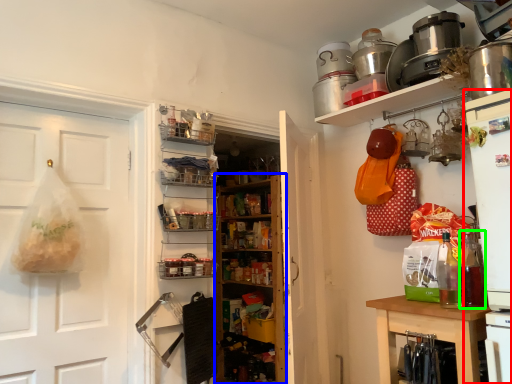
Question: Estimate the real-world distances between objects in this image. Which object is closer to appliance (highlighted by a red box), bookshelf (highlighted by a blue box) or bottle (highlighted by a green box)?

Choices:
 (A) bookshelf
 (B) bottle

Answer: (B)